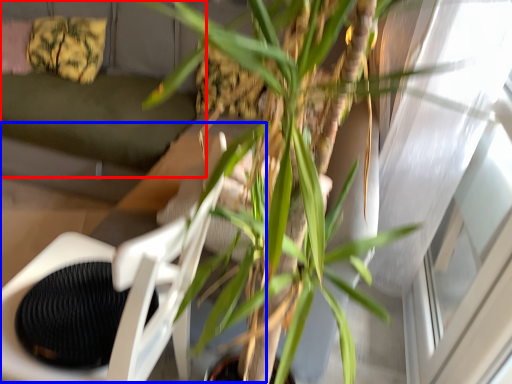
Question: Which object appears farthest to the camera in this image, couch (highlighted by a red box) or swivel chair (highlighted by a blue box)?

Choices:
 (A) couch
 (B) swivel chair

Answer: (A)